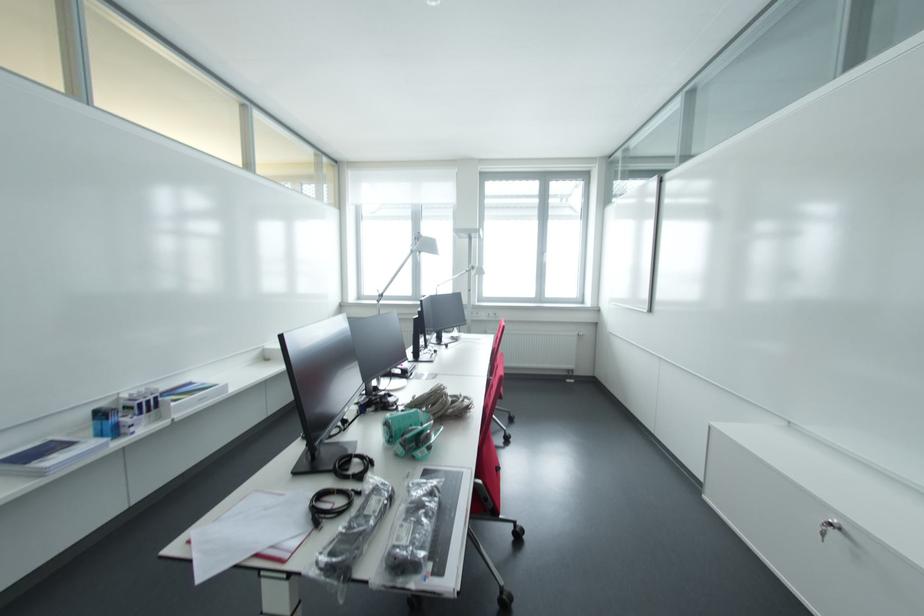
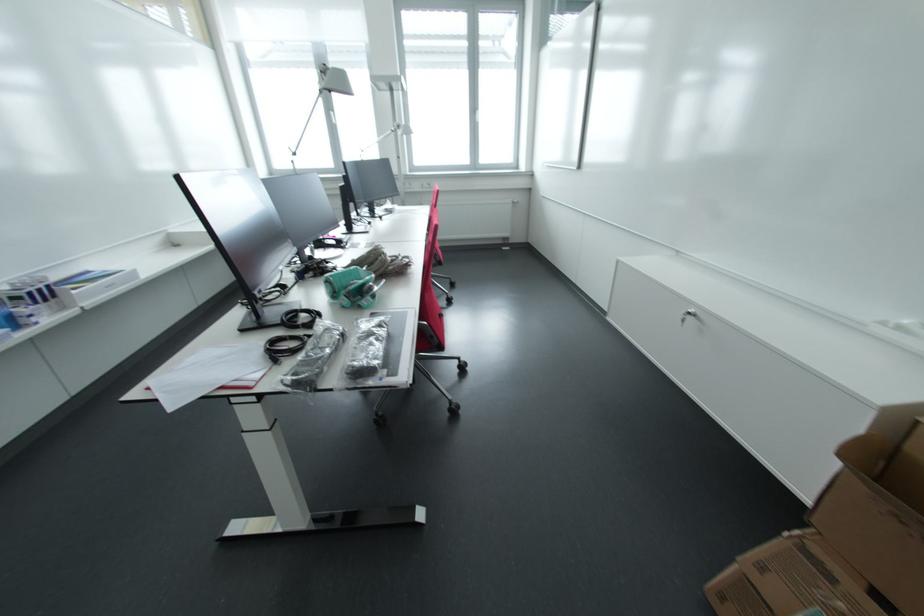
Question: Which direction would the cameraman need to move to produce the second image? Reply with the corresponding letter.

Choices:
 (A) Left
 (B) Right
 (C) Forward
 (D) Backward

Answer: (D)